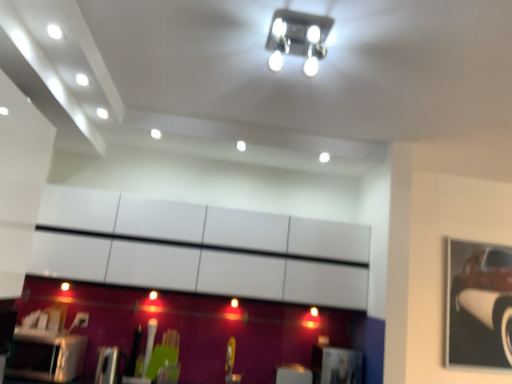
The height and width of the screenshot is (384, 512). What are the coordinates of `vacant space situated above metallic car at right (from a real-world perspective)` in the screenshot? It's located at (476, 237).